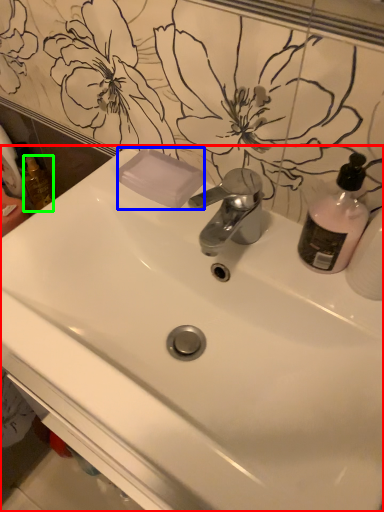
Question: Estimate the real-world distances between objects in this image. Which object is farther from sink (highlighted by a red box), soap (highlighted by a blue box) or mouthwash (highlighted by a green box)?

Choices:
 (A) soap
 (B) mouthwash

Answer: (B)